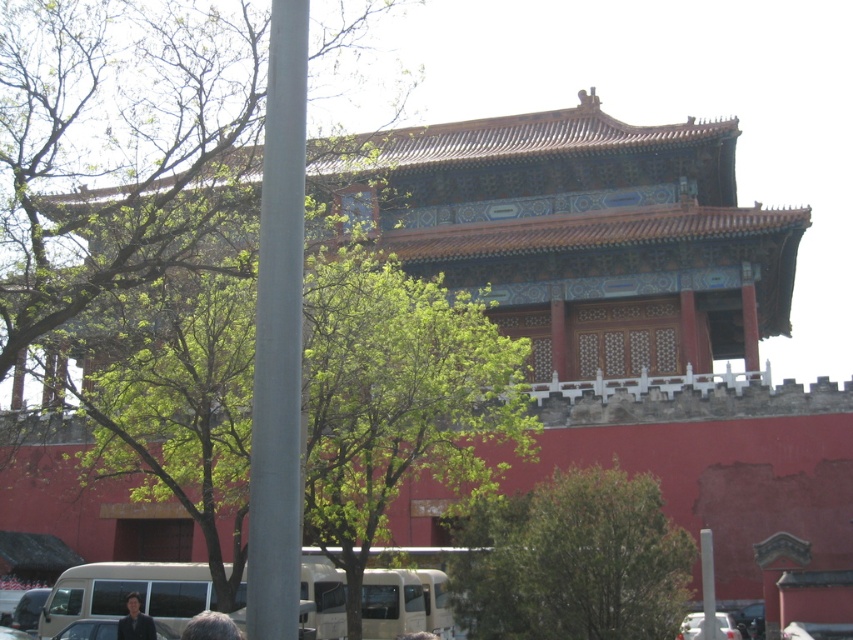
How far apart are white glossy pole at lower right and dark brown hair at lower center?

74.96 feet

Is white glossy pole at lower right bigger than dark brown hair at lower center?

Actually, white glossy pole at lower right might be smaller than dark brown hair at lower center.

At what (x,y) coordinates should I click in order to perform the action: click on white glossy pole at lower right. Please return your answer as a coordinate pair (x, y). The width and height of the screenshot is (853, 640). Looking at the image, I should click on (708, 588).

Is green leafy tree at center further to the viewer compared to metallic gray pole at left?

Yes.

Does point (654, 500) lie behind point (289, 369)?

Yes, point (654, 500) is farther from viewer.

Image resolution: width=853 pixels, height=640 pixels. What do you see at coordinates (572, 561) in the screenshot?
I see `green leafy tree at center` at bounding box center [572, 561].

Where is `green leafy tree at center`? Image resolution: width=853 pixels, height=640 pixels. green leafy tree at center is located at coordinates (572, 561).

Who is more forward, (711, 538) or (149, 636)?

Point (149, 636)

Is point (706, 628) behind point (136, 634)?

That is True.

Locate an element on the screen. Image resolution: width=853 pixels, height=640 pixels. white glossy pole at lower right is located at coordinates (708, 588).